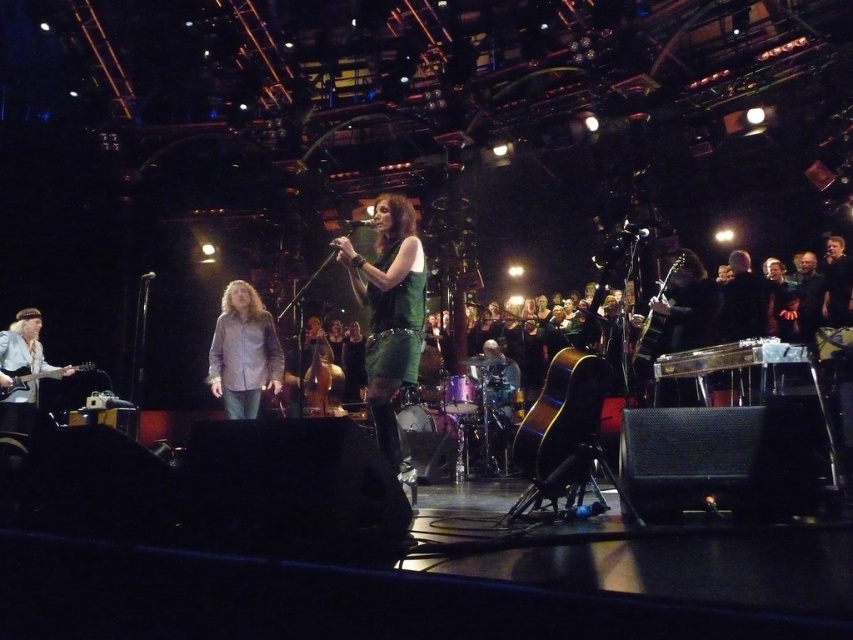
You are sitting in the audience and notice two points on the stage during the concert. The first point is at coordinate point (732, 362) and the second is at point (674, 272). Which point is closer to you?

Point (732, 362) is closer to the viewer than point (674, 272).

You are a stagehand needing to place two markers on the stage at the coordinates point (258, 403) and point (654, 362). Which marker should be placed closer to the front of the stage?

Point (258, 403) should be placed closer to the front of the stage because it is further to the viewer than point (654, 362).

You are a stagehand who needs to move the metallic silver keyboard at right and the shiny metallic guitar at right to the left side of the stage. Given that the available space on the left is only enough for one instrument, which instrument should you prioritize moving based on their sizes?

The metallic silver keyboard at right is smaller than the shiny metallic guitar at right, so you should prioritize moving the metallic silver keyboard at right first since it requires less space and can fit into the available area more easily.